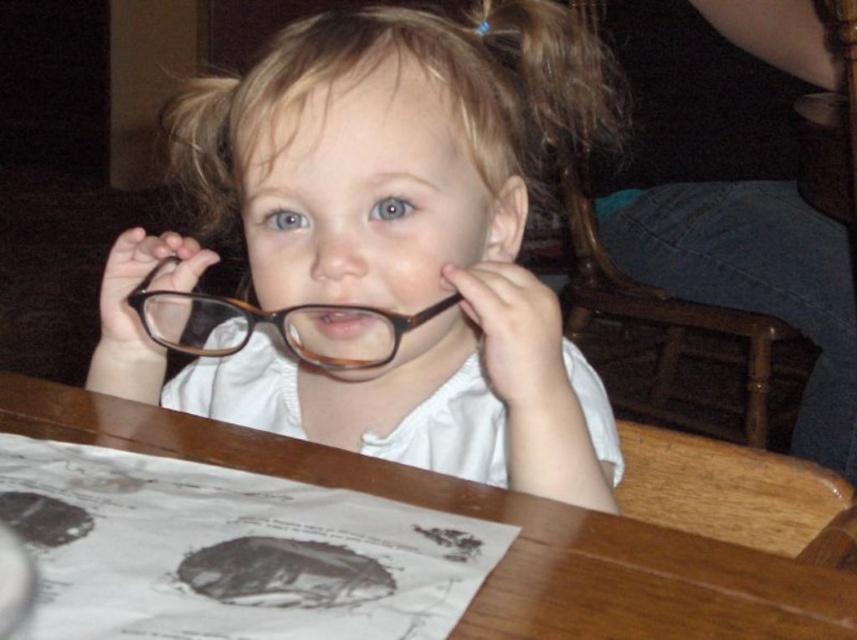
You are a delivery person who needs to place a small package on the wooden table at center without moving the brown plastic glasses at center. Can you fit the package between them?

The wooden table at center and brown plastic glasses at center are 5.12 inches apart from each other. Since the package is small, it can likely fit in the space between them.

Based on the photo, you are a waiter in a restaurant. You see a child sitting at a table with two pairs of glasses. The glasses are matte brown glasses at center and brown plastic glasses at center. The child is holding one pair, and the other is on the table. You need to place a drink 10 centimeters away from the glasses. Where should you put the drink?

The matte brown glasses at center and brown plastic glasses at center are 15.52 centimeters apart. To place the drink 10 centimeters away from the glasses, you can position it between them since the distance between them is more than 10 centimeters, ensuring the drink is safely placed between the two pairs of glasses.